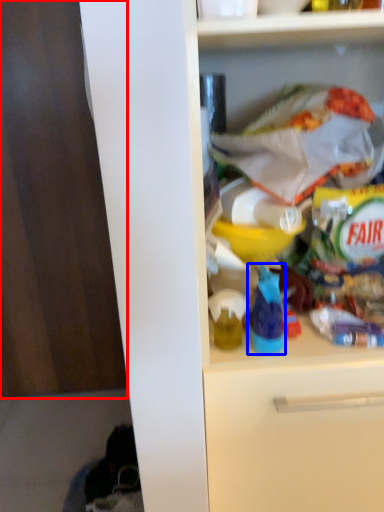
Question: Among these objects, which one is farthest to the camera, leftover (highlighted by a red box) or bottle (highlighted by a blue box)?

Choices:
 (A) leftover
 (B) bottle

Answer: (A)